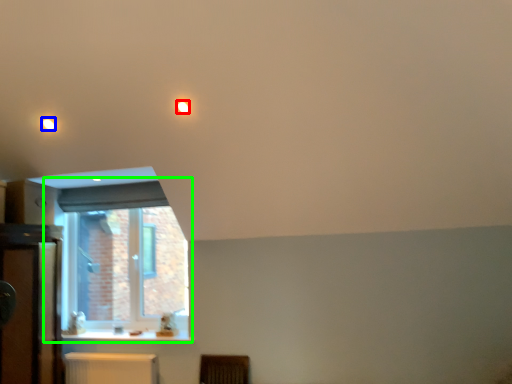
Question: Estimate the real-world distances between objects in this image. Which object is farther from lighting (highlighted by a red box), lighting (highlighted by a blue box) or window (highlighted by a green box)?

Choices:
 (A) lighting
 (B) window

Answer: (B)